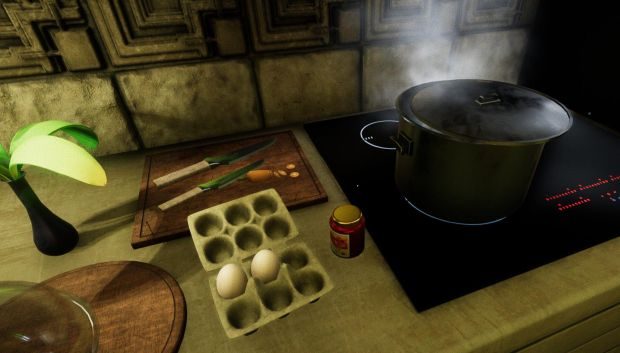
The image size is (620, 353). In order to click on round lid for pot in this screenshot , I will do `click(514, 135)`.